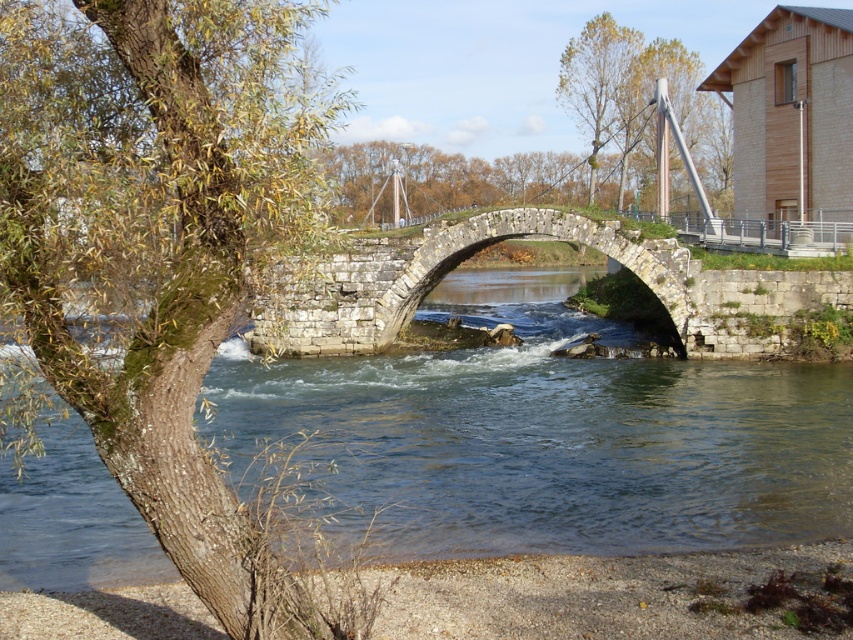
Question: Which point is closer to the camera taking this photo?

Choices:
 (A) (641, 67)
 (B) (114, 172)

Answer: (B)

Question: Estimate the real-world distances between objects in this image. Which object is farther from the green leafy tree at upper center?

Choices:
 (A) green mossy bark tree at left
 (B) stone arch bridge at center
 (C) metallic pole at upper right

Answer: (B)

Question: Is green mossy bark tree at left to the right of green leafy tree at upper center from the viewer's perspective?

Choices:
 (A) no
 (B) yes

Answer: (A)

Question: Among these objects, which one is nearest to the camera?

Choices:
 (A) stone arch bridge at center
 (B) green leafy tree at upper center
 (C) green mossy bark tree at left

Answer: (C)

Question: Is green mossy bark tree at left to the right of green leafy tree at upper center from the viewer's perspective?

Choices:
 (A) yes
 (B) no

Answer: (B)

Question: Is green mossy bark tree at left wider than stone arch bridge at center?

Choices:
 (A) yes
 (B) no

Answer: (B)